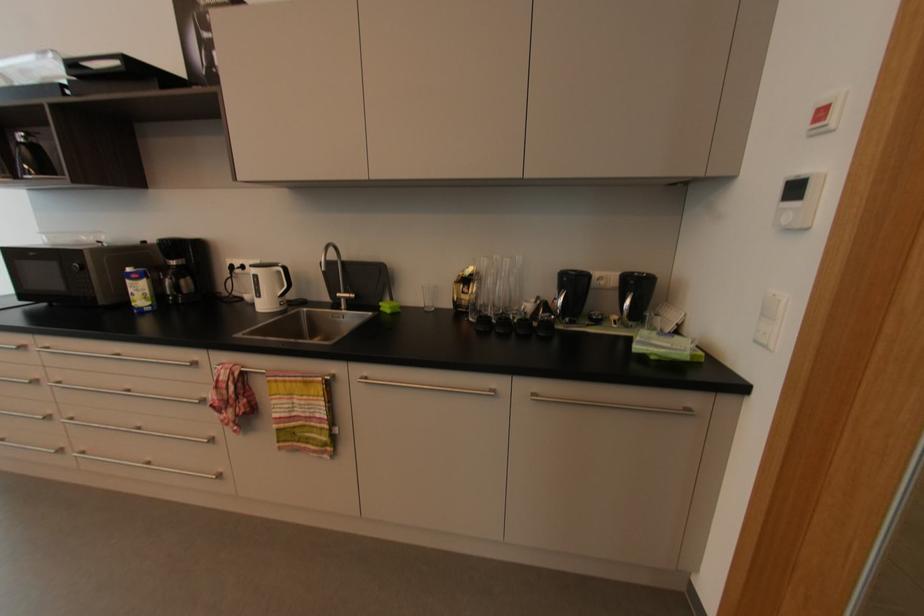
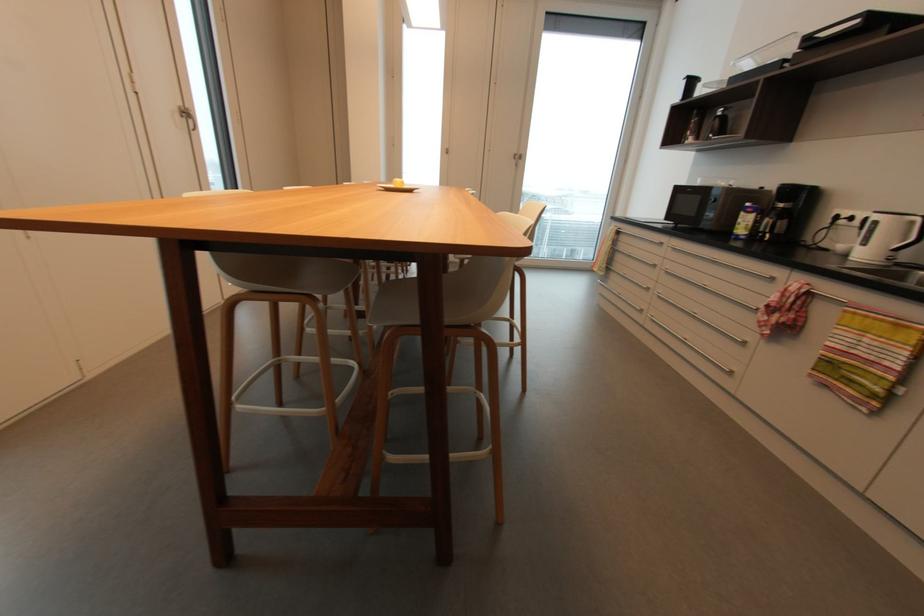
Where in the second image is the point corresponding to pixel 131 270 from the first image?

(750, 205)